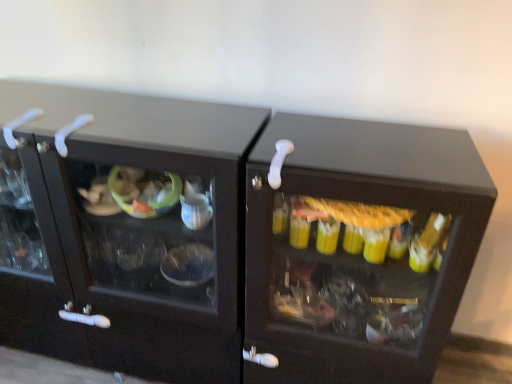
Question: Considering the relative sizes of white plastic door handle at upper left, placed as the second door handle when sorted from left to right, and white plastic door handle at upper left, placed as the 3th door handle when sorted from right to left, in the image provided, is white plastic door handle at upper left, placed as the second door handle when sorted from left to right, bigger than white plastic door handle at upper left, placed as the 3th door handle when sorted from right to left,?

Choices:
 (A) yes
 (B) no

Answer: (A)

Question: Can you confirm if white plastic door handle at upper left, the 2th door handle positioned from the right, is smaller than white plastic door handle at upper left, acting as the 1th door handle starting from the left?

Choices:
 (A) no
 (B) yes

Answer: (A)

Question: Is white plastic door handle at upper left, the 2th door handle positioned from the right, positioned in front of white plastic door handle at upper left, acting as the 1th door handle starting from the left?

Choices:
 (A) no
 (B) yes

Answer: (B)

Question: Is white plastic door handle at upper left, the 2th door handle positioned from the right, thinner than white plastic door handle at upper left, placed as the 3th door handle when sorted from right to left?

Choices:
 (A) no
 (B) yes

Answer: (A)

Question: Can you confirm if white plastic door handle at upper left, the 2th door handle positioned from the right, is shorter than white plastic door handle at upper left, placed as the 3th door handle when sorted from right to left?

Choices:
 (A) no
 (B) yes

Answer: (B)

Question: Is white plastic door handle at upper left, placed as the second door handle when sorted from left to right, oriented away from white plastic door handle at upper left, acting as the 1th door handle starting from the left?

Choices:
 (A) no
 (B) yes

Answer: (A)

Question: Is white plastic door handle at center, arranged as the first door handle when viewed from the right, thinner than white plastic door handle at upper left, acting as the 1th door handle starting from the left?

Choices:
 (A) yes
 (B) no

Answer: (B)

Question: Considering the relative sizes of white plastic door handle at center, the 3th door handle when ordered from left to right, and white plastic door handle at upper left, acting as the 1th door handle starting from the left, in the image provided, is white plastic door handle at center, the 3th door handle when ordered from left to right, bigger than white plastic door handle at upper left, acting as the 1th door handle starting from the left,?

Choices:
 (A) no
 (B) yes

Answer: (A)

Question: Can you confirm if white plastic door handle at center, arranged as the first door handle when viewed from the right, is smaller than white plastic door handle at upper left, placed as the 3th door handle when sorted from right to left?

Choices:
 (A) yes
 (B) no

Answer: (A)

Question: Would you consider white plastic door handle at center, the 3th door handle when ordered from left to right, to be distant from white plastic door handle at upper left, placed as the 3th door handle when sorted from right to left?

Choices:
 (A) no
 (B) yes

Answer: (A)

Question: From the image's perspective, is white plastic door handle at center, the 3th door handle when ordered from left to right, above white plastic door handle at upper left, acting as the 1th door handle starting from the left?

Choices:
 (A) yes
 (B) no

Answer: (B)

Question: From the image's perspective, is white plastic door handle at center, arranged as the first door handle when viewed from the right, located beneath white plastic door handle at upper left, placed as the 3th door handle when sorted from right to left?

Choices:
 (A) yes
 (B) no

Answer: (A)

Question: Is the position of white plastic door handle at upper left, acting as the 1th door handle starting from the left, less distant than that of white plastic door handle at center, the 3th door handle when ordered from left to right?

Choices:
 (A) yes
 (B) no

Answer: (B)